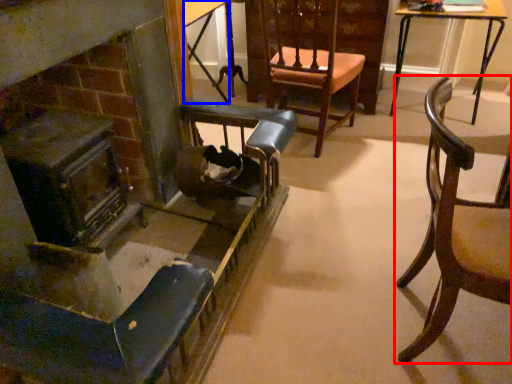
Question: Which point is closer to the camera, chair (highlighted by a red box) or table (highlighted by a blue box)?

Choices:
 (A) chair
 (B) table

Answer: (A)